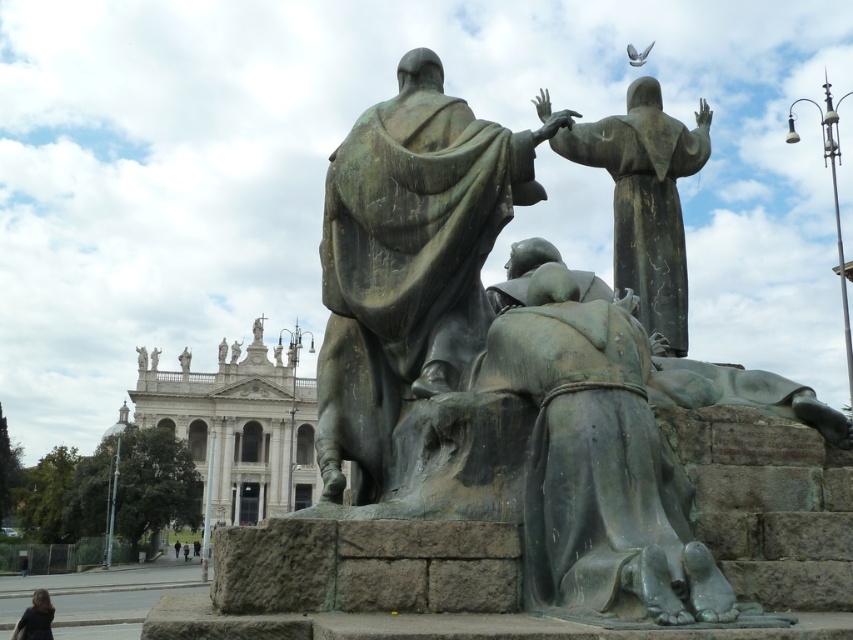
Does bronze statue at center have a smaller size compared to green patina bronze statue at center?

No, bronze statue at center is not smaller than green patina bronze statue at center.

Who is more distant from viewer, (480,314) or (686,621)?

The point (480,314) is behind.

At what (x,y) coordinates should I click in order to perform the action: click on bronze statue at center. Please return your answer as a coordinate pair (x, y). The width and height of the screenshot is (853, 640). Looking at the image, I should click on (408, 260).

In the scene shown: Who is positioned more to the right, green patina bronze statue at center or dark brown hair at lower left?

green patina bronze statue at center

Who is higher up, green patina bronze statue at center or dark brown hair at lower left?

Positioned higher is green patina bronze statue at center.

Does point (666, 602) come farther from viewer compared to point (33, 618)?

That is False.

At what (x,y) coordinates should I click in order to perform the action: click on green patina bronze statue at center. Please return your answer as a coordinate pair (x, y). Looking at the image, I should click on (595, 458).

Between point (430, 208) and point (45, 612), which one is positioned behind?

The point (45, 612) is more distant.

This screenshot has height=640, width=853. In order to click on bronze statue at center in this screenshot , I will do `click(408, 260)`.

Is point (469, 227) in front of point (36, 609)?

Yes, point (469, 227) is in front of point (36, 609).

The height and width of the screenshot is (640, 853). In order to click on bronze statue at center in this screenshot , I will do `click(408, 260)`.